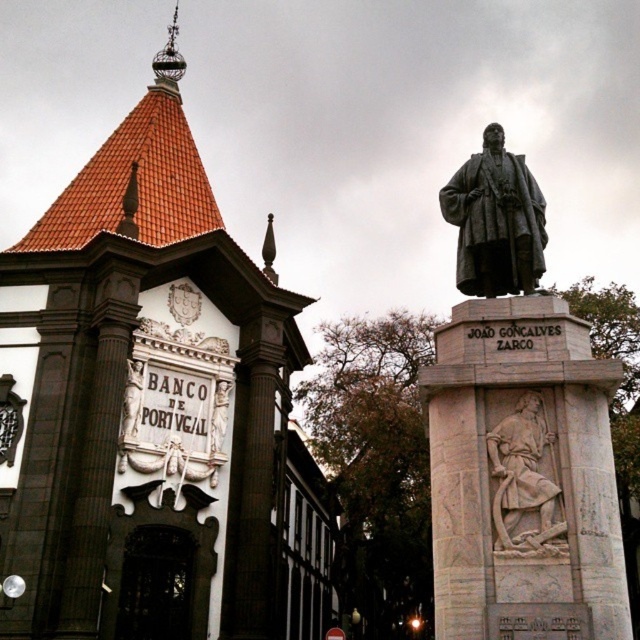
You are a tourist standing in front of the bronze statue at center and the gray stone relief at center. Which object is closer to you?

The bronze statue at center is closer to you because the gray stone relief at center is behind it.

You are a tourist standing in front of the historical urban scene. You see the bronze statue at center and the gray stone relief at center. Which one is positioned to the left?

The bronze statue at center is positioned to the left of the gray stone relief at center.

You are a tourist standing at the entrance of the Banco de Portugal. You want to take a photo that includes both the gray stone relief at center and the polished bronze statue at center in the same frame. Given that your camera has a maximum zoom range of 50 meters, will you be able to capture both objects in one shot?

The gray stone relief at center is 38.71 meters away from the polished bronze statue at center. Since your camera can zoom up to 50 meters, you can capture both objects in one shot as the distance between them is within the camera range.